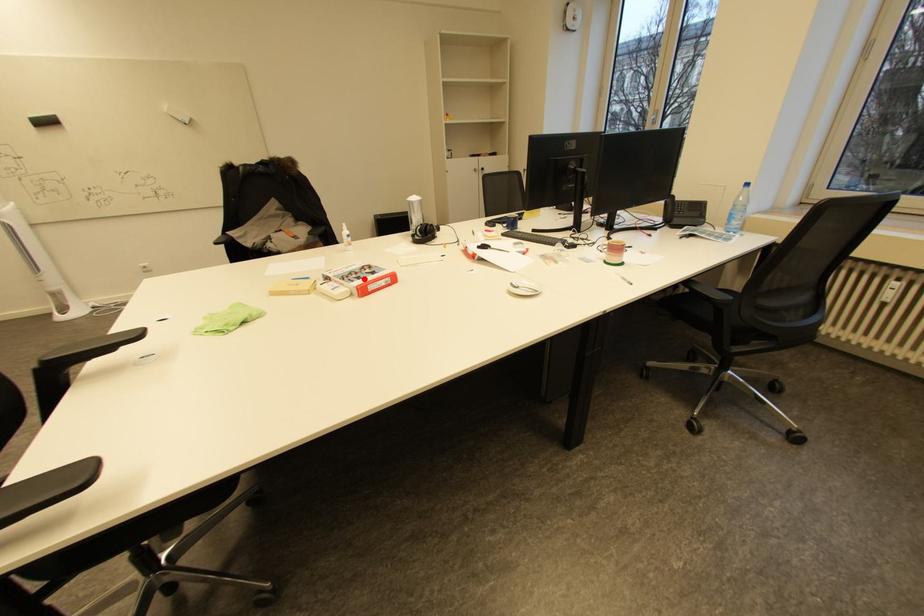
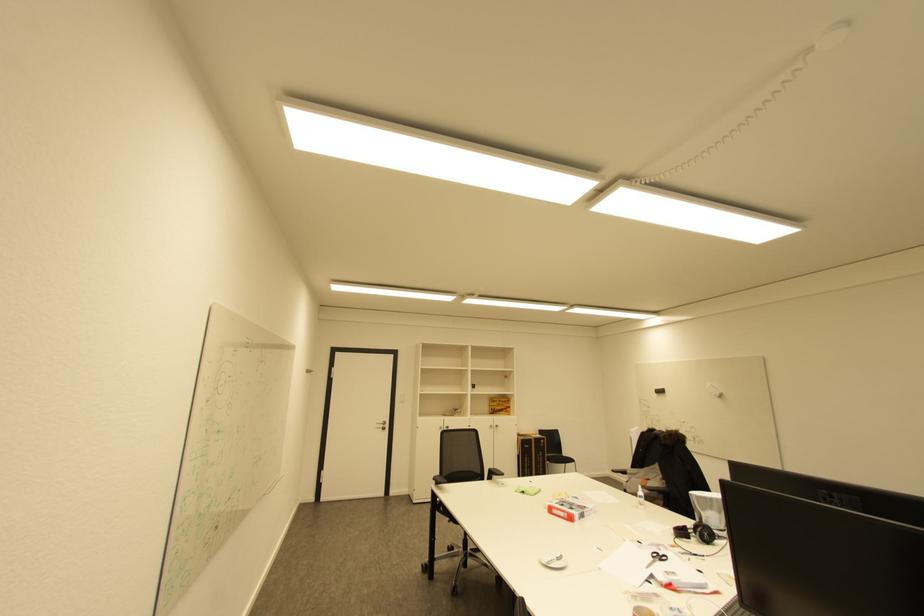
Question: I am providing you with two images of the same scene from different viewpoints. Image1 has a red point marked. In image2, the corresponding 3D location appears at what relative position? Reply with the corresponding letter.

Choices:
 (A) Closer
 (B) Farther

Answer: (A)